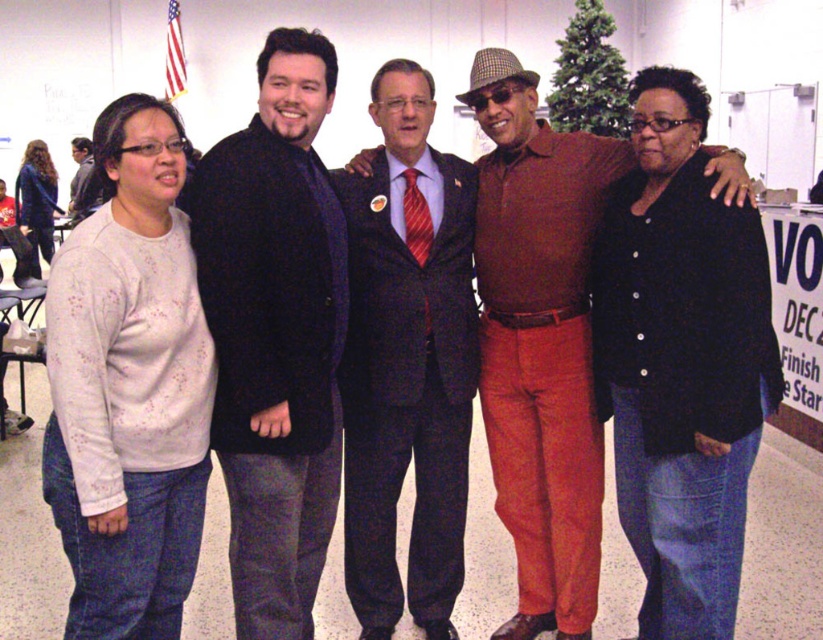
Is matte black jacket at right closer to camera compared to dark blue suit at center?

Yes, matte black jacket at right is closer to the viewer.

Is point (672, 76) farther from viewer compared to point (377, 246)?

No, it is in front of (377, 246).

Who is more forward, (710,369) or (468,396)?

Point (710,369) is more forward.

This screenshot has height=640, width=823. What are the coordinates of `matte black jacket at right` in the screenshot? It's located at (682, 362).

What do you see at coordinates (129, 387) in the screenshot? Image resolution: width=823 pixels, height=640 pixels. I see `white speckled sweater at left` at bounding box center [129, 387].

Between white speckled sweater at left and matte black sweater at left, which one appears on the left side from the viewer's perspective?

Positioned to the left is matte black sweater at left.

You are a GUI agent. You are given a task and a screenshot of the screen. Output one action in this format:
    pyautogui.click(x=<x>, y=<y>)
    Task: Click on the white speckled sweater at left
    The image size is (823, 640).
    Given the screenshot: What is the action you would take?
    pyautogui.click(x=129, y=387)

Who is higher up, dark wool coat at center or matte black sweater at left?

matte black sweater at left is above.

Looking at this image, can you confirm if dark wool coat at center is wider than matte black sweater at left?

No.

Between point (271, 589) and point (87, 179), which one is positioned in front?

Point (271, 589)

The image size is (823, 640). I want to click on dark wool coat at center, so click(x=275, y=333).